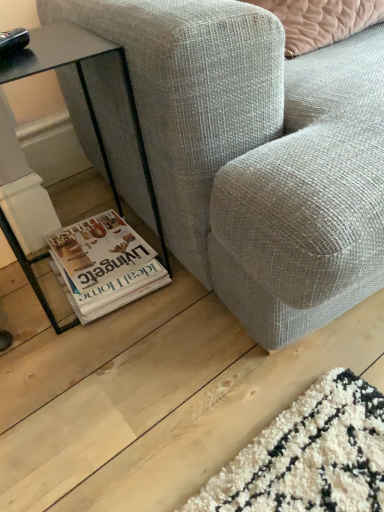
Image resolution: width=384 pixels, height=512 pixels. In order to click on black glass table at lower left in this screenshot , I will do `click(81, 86)`.

In order to face textured gray fabric couch at lower center, should I rotate leftwards or rightwards?

Turn right by 21.113 degrees to look at textured gray fabric couch at lower center.

Find the location of a particular element. black glass table at lower left is located at coordinates (81, 86).

Does textured gray fabric couch at lower center turn towards white glossy magazine at lower left?

No, textured gray fabric couch at lower center is not aimed at white glossy magazine at lower left.

From the image's perspective, which object appears higher, textured gray fabric couch at lower center or white glossy magazine at lower left?

textured gray fabric couch at lower center appears higher in the image.

Is textured gray fabric couch at lower center completely or partially outside of white glossy magazine at lower left?

textured gray fabric couch at lower center lies outside white glossy magazine at lower left's area.

At what (x,y) coordinates should I click in order to perform the action: click on studio couch above the white glossy magazine at lower left (from the image's perspective). Please return your answer as a coordinate pair (x, y). This screenshot has width=384, height=512. Looking at the image, I should click on (256, 154).

From the picture: Does textured gray fabric couch at lower center have a greater width compared to black glass table at lower left?

Yes.

Is textured gray fabric couch at lower center far away from black glass table at lower left?

No, textured gray fabric couch at lower center is in close proximity to black glass table at lower left.

Considering the relative positions of textured gray fabric couch at lower center and black glass table at lower left in the image provided, is textured gray fabric couch at lower center to the right of black glass table at lower left from the viewer's perspective?

Correct, you'll find textured gray fabric couch at lower center to the right of black glass table at lower left.

Which object is closer to the camera taking this photo, textured gray fabric couch at lower center or black glass table at lower left?

textured gray fabric couch at lower center is in front.

From the image's perspective, does black glass table at lower left appear lower than textured gray fabric couch at lower center?

Indeed, from the image's perspective, black glass table at lower left is shown beneath textured gray fabric couch at lower center.

Locate an element on the screen. This screenshot has height=512, width=384. studio couch above the black glass table at lower left (from a real-world perspective) is located at coordinates (256, 154).

From a real-world perspective, is black glass table at lower left positioned over textured gray fabric couch at lower center based on gravity?

Incorrect, from a real-world perspective, black glass table at lower left is lower than textured gray fabric couch at lower center.

Considering the relative positions of black glass table at lower left and white glossy magazine at lower left in the image provided, is black glass table at lower left to the left of white glossy magazine at lower left from the viewer's perspective?

Yes, black glass table at lower left is to the left of white glossy magazine at lower left.

Which object is thinner, black glass table at lower left or white glossy magazine at lower left?

With smaller width is black glass table at lower left.

From a real-world perspective, who is located lower, black glass table at lower left or white glossy magazine at lower left?

white glossy magazine at lower left, from a real-world perspective.

Locate an element on the screen. The image size is (384, 512). paperback book below the textured gray fabric couch at lower center (from a real-world perspective) is located at coordinates (105, 265).

Which of these two, white glossy magazine at lower left or textured gray fabric couch at lower center, is smaller?

Smaller between the two is white glossy magazine at lower left.

Is white glossy magazine at lower left directly adjacent to textured gray fabric couch at lower center?

white glossy magazine at lower left is not next to textured gray fabric couch at lower center, and they're not touching.

Is white glossy magazine at lower left positioned with its back to textured gray fabric couch at lower center?

No, white glossy magazine at lower left is not facing the opposite direction of textured gray fabric couch at lower center.

Is white glossy magazine at lower left aimed at black glass table at lower left?

Yes, white glossy magazine at lower left is turned towards black glass table at lower left.

Can you confirm if white glossy magazine at lower left is smaller than black glass table at lower left?

Correct, white glossy magazine at lower left occupies less space than black glass table at lower left.

Where is `table above the white glossy magazine at lower left (from the image's perspective)`? Image resolution: width=384 pixels, height=512 pixels. table above the white glossy magazine at lower left (from the image's perspective) is located at coordinates (81, 86).

Find the location of a particular element. This screenshot has width=384, height=512. paperback book below the textured gray fabric couch at lower center (from the image's perspective) is located at coordinates [x=105, y=265].

This screenshot has width=384, height=512. What are the coordinates of `table below the textured gray fabric couch at lower center (from a real-world perspective)` in the screenshot? It's located at (81, 86).

When comparing their distances from textured gray fabric couch at lower center, does white glossy magazine at lower left or black glass table at lower left seem closer?

black glass table at lower left.

Estimate the real-world distances between objects in this image. Which object is closer to white glossy magazine at lower left, black glass table at lower left or textured gray fabric couch at lower center?

Among the two, black glass table at lower left is located nearer to white glossy magazine at lower left.

Which object lies nearer to the anchor point black glass table at lower left, textured gray fabric couch at lower center or white glossy magazine at lower left?

Among the two, white glossy magazine at lower left is located nearer to black glass table at lower left.

When comparing their distances from white glossy magazine at lower left, does textured gray fabric couch at lower center or black glass table at lower left seem closer?

The object closer to white glossy magazine at lower left is black glass table at lower left.

In the scene shown: Looking at the image, which one is located further to black glass table at lower left, white glossy magazine at lower left or textured gray fabric couch at lower center?

The object further to black glass table at lower left is textured gray fabric couch at lower center.

In the scene shown: Looking at the image, which one is located closer to textured gray fabric couch at lower center, black glass table at lower left or white glossy magazine at lower left?

Based on the image, black glass table at lower left appears to be nearer to textured gray fabric couch at lower center.

You are a GUI agent. You are given a task and a screenshot of the screen. Output one action in this format:
    pyautogui.click(x=<x>, y=<y>)
    Task: Click on the paperback book situated between black glass table at lower left and textured gray fabric couch at lower center from left to right
    Image resolution: width=384 pixels, height=512 pixels.
    Given the screenshot: What is the action you would take?
    pyautogui.click(x=105, y=265)